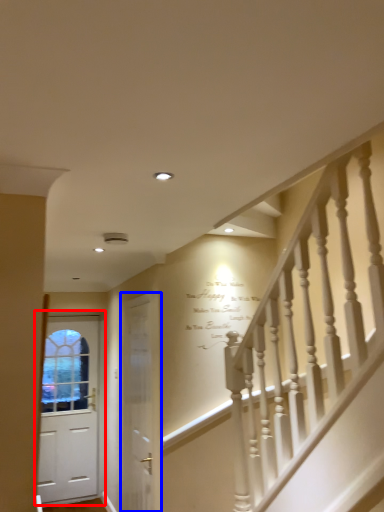
Question: Which object appears farthest to the camera in this image, door (highlighted by a red box) or door (highlighted by a blue box)?

Choices:
 (A) door
 (B) door

Answer: (A)